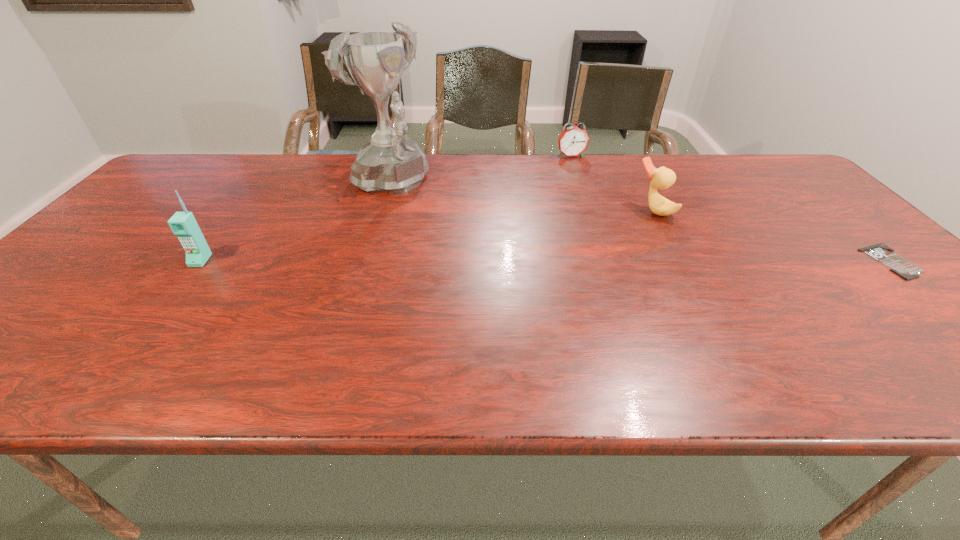
This screenshot has height=540, width=960. Identify the location of alarm clock that is at the far edge. [x=573, y=141].

Where is `award that is at the far edge`? The height and width of the screenshot is (540, 960). award that is at the far edge is located at coordinates (391, 162).

At what (x,y) coordinates should I click in order to perform the action: click on object located in the right edge section of the desktop. Please return your answer as a coordinate pair (x, y). The image size is (960, 540). Looking at the image, I should click on (904, 268).

I want to click on vacant region at the far edge of the desktop, so click(x=475, y=185).

I want to click on free location at the near edge, so click(x=186, y=329).

This screenshot has width=960, height=540. What are the coordinates of `vacant region at the left edge` in the screenshot? It's located at point(176,200).

The height and width of the screenshot is (540, 960). In order to click on free location at the far left corner of the desktop in this screenshot , I will do `click(217, 153)`.

You are a GUI agent. You are given a task and a screenshot of the screen. Output one action in this format:
    pyautogui.click(x=<x>, y=<y>)
    Task: Click on the free point between the tallest object and the leftmost object
    The width and height of the screenshot is (960, 540).
    Given the screenshot: What is the action you would take?
    pyautogui.click(x=295, y=222)

Identify the location of vacant area that lies between the shortest object and the farthest object. The height and width of the screenshot is (540, 960). (732, 209).

Locate an element on the screen. free space between the duck and the shortest object is located at coordinates (773, 236).